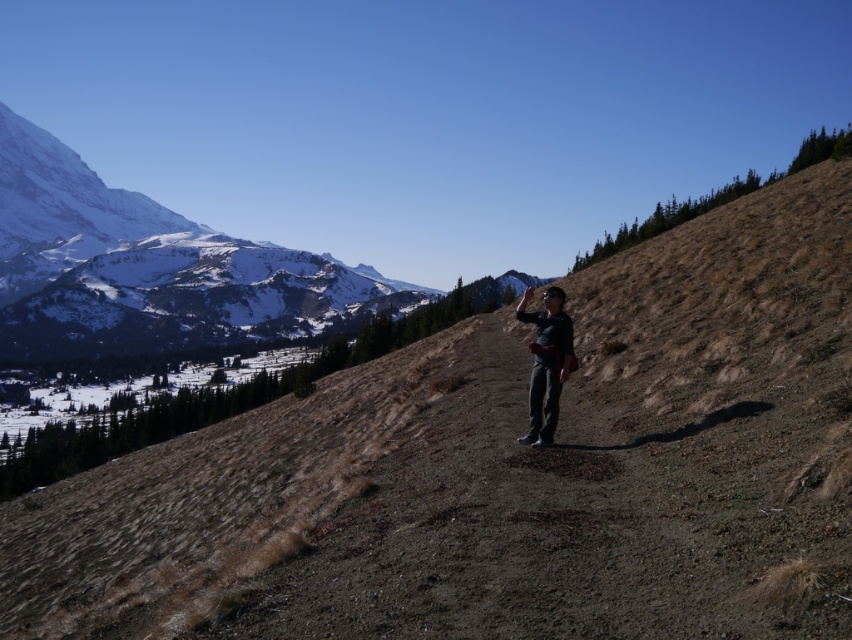
Does snowy granite mountain at upper left have a lesser height compared to dark gray pants at center?

No, snowy granite mountain at upper left is not shorter than dark gray pants at center.

Between point (308, 307) and point (522, 317), which one is positioned behind?

Positioned behind is point (308, 307).

Image resolution: width=852 pixels, height=640 pixels. In order to click on snowy granite mountain at upper left in this screenshot , I will do `click(147, 268)`.